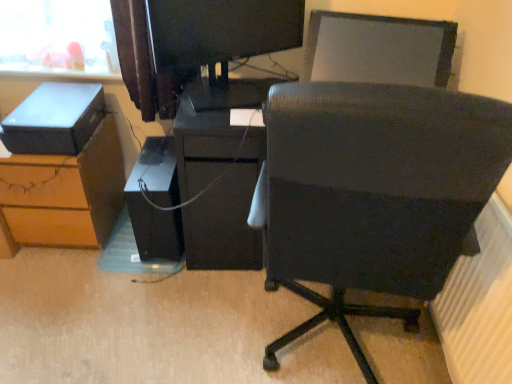
The height and width of the screenshot is (384, 512). Identify the location of vacant space to the left of black fabric chair at center. (178, 321).